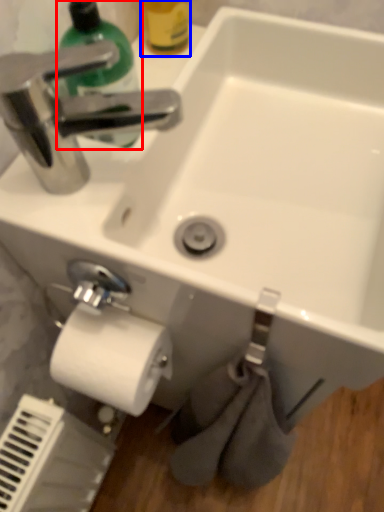
Question: Which object is further to the camera taking this photo, cleaning product (highlighted by a red box) or bottle (highlighted by a blue box)?

Choices:
 (A) cleaning product
 (B) bottle

Answer: (B)